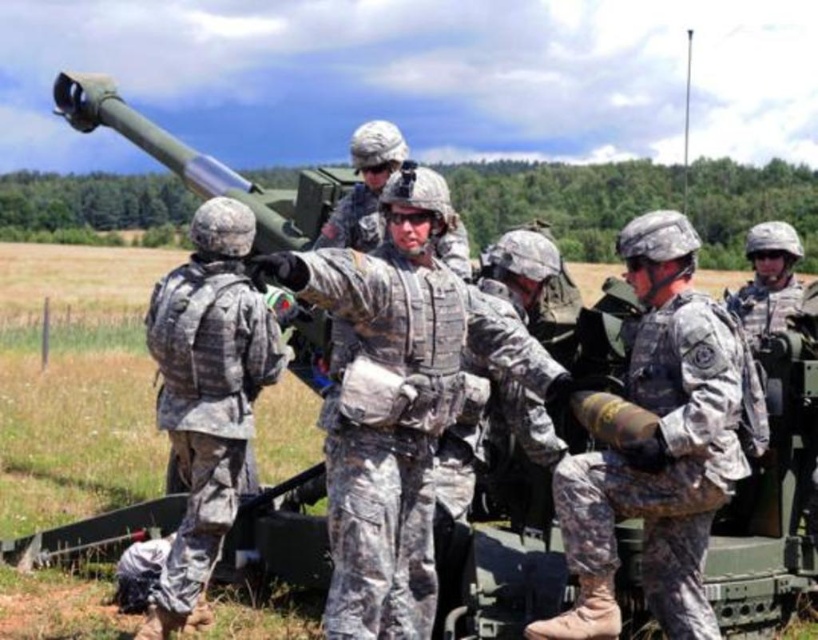
You are a military observer positioned at the edge of the training field. You notice two items at the center of the image, the camouflage uniform at center and the camouflage fabric bomb at center. Which item is nearer to your current position?

The camouflage uniform at center is closer to the viewer than the camouflage fabric bomb at center, so the camouflage uniform at center is nearer to your current position.

You are a drone operator observing the military training exercise. You notice two points in the scene at coordinates point (380, 332) and point (661, 353). Which point is nearer to your camera?

Point (380, 332) is closer to the camera than point (661, 353).

You are a soldier in the training exercise and need to move from the point at coordinate (318, 298) to the artillery piece. Can you safely walk in a straight line between them?

The distance between the point at coordinate (318, 298) and the artillery piece is 11.99 feet. Since there are no obstacles mentioned in the scene description, you can safely walk in a straight line between them.